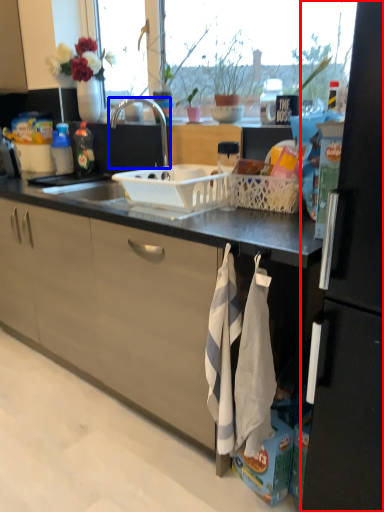
Question: Which of the following is the farthest to the observer, refrigerator (highlighted by a red box) or tap (highlighted by a blue box)?

Choices:
 (A) refrigerator
 (B) tap

Answer: (B)